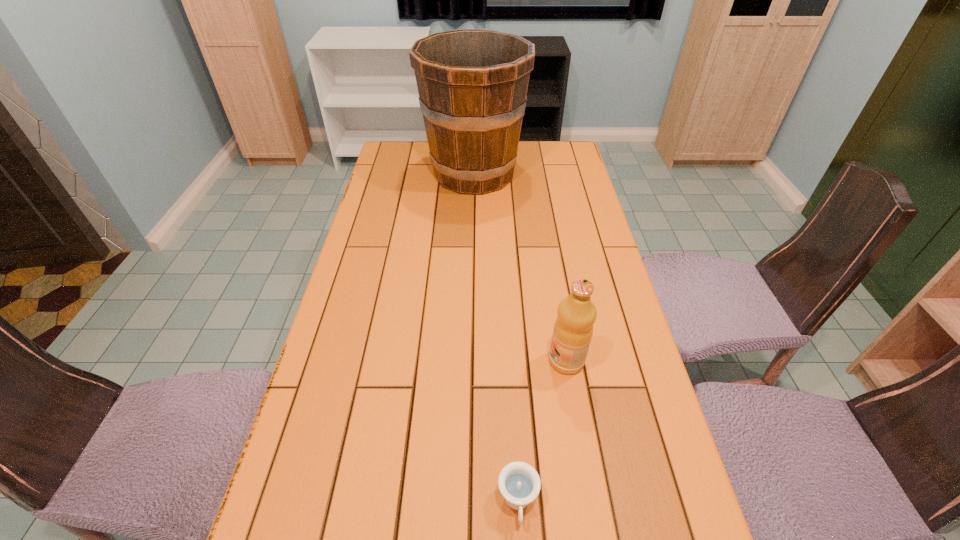
You are a GUI agent. You are given a task and a screenshot of the screen. Output one action in this format:
    pyautogui.click(x=<x>, y=<y>)
    Task: Click on the object located in the far edge section of the desktop
    
    Given the screenshot: What is the action you would take?
    pyautogui.click(x=472, y=84)

The height and width of the screenshot is (540, 960). In order to click on object situated at the right edge in this screenshot , I will do `click(573, 329)`.

Find the location of `vacant space at the left edge`. vacant space at the left edge is located at coordinates (383, 322).

I want to click on free spot at the right edge of the desktop, so [x=599, y=378].

In order to click on vacant space at the far left corner of the desktop in this screenshot , I will do `click(408, 143)`.

Locate an element on the screen. This screenshot has width=960, height=540. free space that is in between the tallest object and the second tallest object is located at coordinates (x=520, y=267).

At what (x,y) coordinates should I click in order to perform the action: click on free space between the farthest object and the teacup. Please return your answer as a coordinate pair (x, y). This screenshot has height=540, width=960. Looking at the image, I should click on (496, 339).

Where is `free space between the nearest object and the farthest object`? Image resolution: width=960 pixels, height=540 pixels. free space between the nearest object and the farthest object is located at coordinates (496, 339).

This screenshot has height=540, width=960. I want to click on free space between the bucket and the teacup, so click(496, 339).

At what (x,y) coordinates should I click in order to perform the action: click on vacant area that lies between the tallest object and the fruit juice. Please return your answer as a coordinate pair (x, y). The image size is (960, 540). Looking at the image, I should click on pyautogui.click(x=520, y=267).